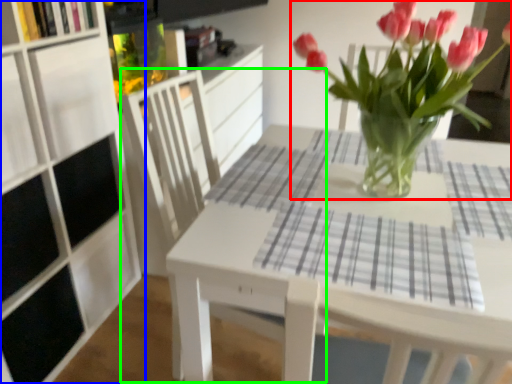
Question: Estimate the real-world distances between objects in this image. Which object is farther from houseplant (highlighted by a red box), cabinetry (highlighted by a blue box) or armchair (highlighted by a green box)?

Choices:
 (A) cabinetry
 (B) armchair

Answer: (A)